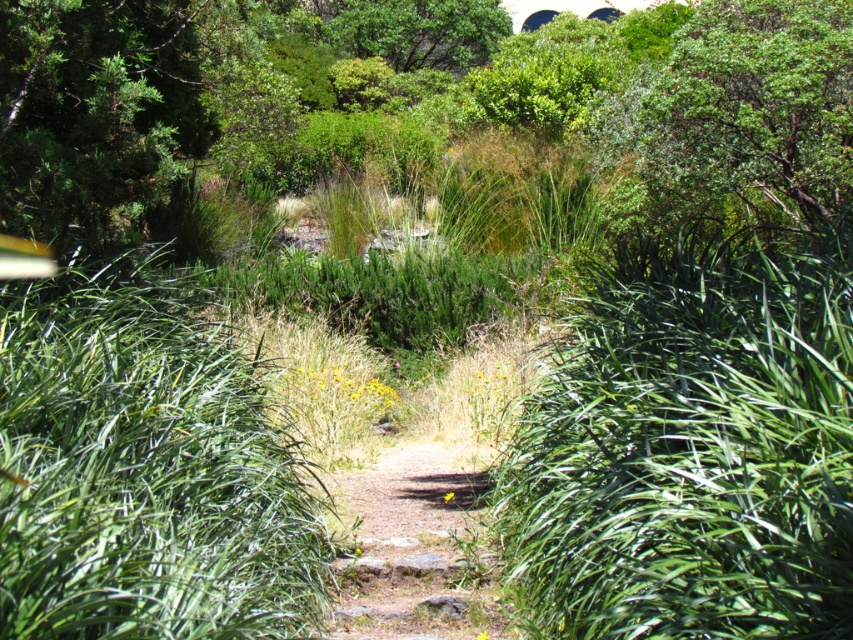
Which is more to the left, green leafy bush at center or green leafy tree at upper right?

Positioned to the left is green leafy bush at center.

What do you see at coordinates (691, 449) in the screenshot? The image size is (853, 640). I see `green leafy bush at center` at bounding box center [691, 449].

I want to click on green leafy bush at center, so click(x=691, y=449).

Find the location of `green leafy tree at upper right`. green leafy tree at upper right is located at coordinates (753, 113).

Where is `green leafy tree at upper right`? green leafy tree at upper right is located at coordinates (753, 113).

Is green leafy bush at center bigger than dirt path at center?

Yes, green leafy bush at center is bigger than dirt path at center.

Is green leafy bush at center to the right of dirt path at center from the viewer's perspective?

Correct, you'll find green leafy bush at center to the right of dirt path at center.

Between point (537, 618) and point (367, 483), which one is positioned in front?

Point (537, 618) is more forward.

Locate an element on the screen. green leafy bush at center is located at coordinates (691, 449).